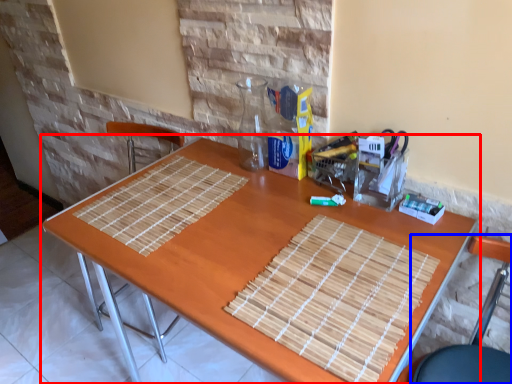
Question: Among these objects, which one is nearest to the camera, table (highlighted by a red box) or chair (highlighted by a blue box)?

Choices:
 (A) table
 (B) chair

Answer: (B)